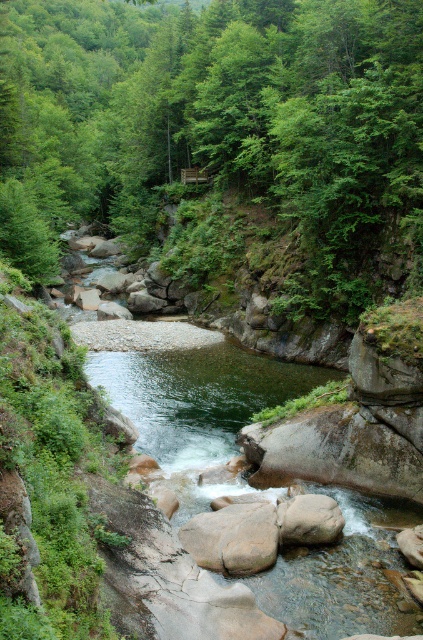
Which is below, green leafy tree at center or smooth gray rock at center?

smooth gray rock at center is below.

Who is taller, green leafy tree at center or smooth gray rock at center?

Standing taller between the two is green leafy tree at center.

Does point (342, 147) come farther from viewer compared to point (321, 515)?

Yes, it is.

Identify the location of green leafy tree at center. The height and width of the screenshot is (640, 423). tap(219, 125).

Image resolution: width=423 pixels, height=640 pixels. Describe the element at coordinates (233, 538) in the screenshot. I see `brown rough boulder at center` at that location.

Does brown rough boulder at center have a lesser width compared to smooth gray rock at center?

Incorrect, brown rough boulder at center's width is not less than smooth gray rock at center's.

The width and height of the screenshot is (423, 640). I want to click on brown rough boulder at center, so click(x=233, y=538).

Who is taller, green leafy tree at center or brown rough boulder at center?

With more height is green leafy tree at center.

Locate an element on the screen. green leafy tree at center is located at coordinates (219, 125).

The image size is (423, 640). I want to click on green leafy tree at center, so click(219, 125).